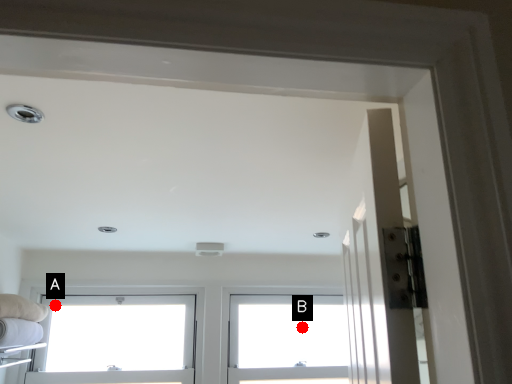
Question: Two points are circled on the image, labeled by A and B beside each circle. Which point is farther to the camera?

Choices:
 (A) A is further
 (B) B is further

Answer: (B)